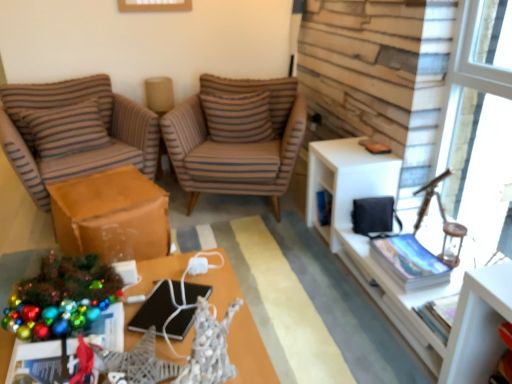
Describe the element at coordinates (154, 309) in the screenshot. I see `black matte laptop at center` at that location.

You are a GUI agent. You are given a task and a screenshot of the screen. Output one action in this format:
    pyautogui.click(x=<x>, y=<y>)
    Task: Click on the brown paper bag at lower left
    
    Given the screenshot: What is the action you would take?
    pyautogui.click(x=111, y=216)

The image size is (512, 384). What do you see at coordinates (111, 216) in the screenshot? I see `brown paper bag at lower left` at bounding box center [111, 216].

At what (x,y) coordinates should I click in order to perform the action: click on striped fabric pillow at left, which ranks as the first pillow in left-to-right order. Please return your answer as a coordinate pair (x, y). This screenshot has width=512, height=384. Looking at the image, I should click on (66, 128).

This screenshot has height=384, width=512. What do you see at coordinates (480, 124) in the screenshot?
I see `transparent glass window at upper right` at bounding box center [480, 124].

Measure the distance between point (372, 272) and camera.

Point (372, 272) is 6.40 feet from camera.

Locate an element on the screen. black matte laptop at center is located at coordinates (154, 309).

Based on their sizes in the image, would you say metallic silver desk at center is bigger or smaller than brown striped fabric chair at left, acting as the first chair starting from the left?

metallic silver desk at center is smaller than brown striped fabric chair at left, acting as the first chair starting from the left.

Can you confirm if metallic silver desk at center is thinner than brown striped fabric chair at left, acting as the first chair starting from the left?

Yes, metallic silver desk at center is thinner than brown striped fabric chair at left, acting as the first chair starting from the left.

Identify the location of chair that is the 1st object above the metallic silver desk at center (from a real-world perspective). (74, 132).

From the image's perspective, does metallic silver desk at center appear lower than brown striped fabric chair at left, positioned as the second chair in right-to-left order?

Yes.

Considering the relative sizes of transparent glass window at upper right and metallic silver desk at center in the image provided, is transparent glass window at upper right wider than metallic silver desk at center?

In fact, transparent glass window at upper right might be narrower than metallic silver desk at center.

Between transparent glass window at upper right and metallic silver desk at center, which one appears on the left side from the viewer's perspective?

metallic silver desk at center.

I want to click on window that is above the metallic silver desk at center (from the image's perspective), so click(x=480, y=124).

From a real-world perspective, is transparent glass window at upper right above or below metallic silver desk at center?

In terms of real-world spatial position, transparent glass window at upper right is above metallic silver desk at center.

Choose the correct answer: Is brown striped pillow at center, the first pillow in the right-to-left sequence, inside black matte laptop at center or outside it?

brown striped pillow at center, the first pillow in the right-to-left sequence, is not inside black matte laptop at center, it's outside.

Is brown striped pillow at center, which is the second pillow in left-to-right order, bigger than black matte laptop at center?

Correct, brown striped pillow at center, which is the second pillow in left-to-right order, is larger in size than black matte laptop at center.

Looking at this image, considering the sizes of brown striped pillow at center, the first pillow in the right-to-left sequence, and black matte laptop at center in the image, is brown striped pillow at center, the first pillow in the right-to-left sequence, wider or thinner than black matte laptop at center?

Clearly, brown striped pillow at center, the first pillow in the right-to-left sequence, has more width compared to black matte laptop at center.

Identify the location of laptop that is below the brown striped pillow at center, which is the second pillow in left-to-right order (from the image's perspective). (154, 309).

Which object is further away from the camera taking this photo, brown paper bag at lower left or transparent glass window at upper right?

Positioned behind is brown paper bag at lower left.

Which object is positioned more to the right, brown paper bag at lower left or transparent glass window at upper right?

transparent glass window at upper right is more to the right.

From the image's perspective, is brown paper bag at lower left located above or below transparent glass window at upper right?

Based on their image positions, brown paper bag at lower left is located beneath transparent glass window at upper right.

Can you tell me how much brown paper bag at lower left and transparent glass window at upper right differ in facing direction?

The angle between the facing direction of brown paper bag at lower left and the facing direction of transparent glass window at upper right is 112 degrees.

Is brown striped fabric chair at left, acting as the first chair starting from the left, beside striped fabric pillow at left, which ranks as the first pillow in left-to-right order?

Yes, the surface of brown striped fabric chair at left, acting as the first chair starting from the left, is in contact with striped fabric pillow at left, which ranks as the first pillow in left-to-right order.

Between brown striped fabric chair at left, acting as the first chair starting from the left, and striped fabric pillow at left, which ranks as the first pillow in left-to-right order, which one appears on the left side from the viewer's perspective?

striped fabric pillow at left, which ranks as the first pillow in left-to-right order.

Is brown striped fabric chair at left, positioned as the second chair in right-to-left order, taller or shorter than striped fabric pillow at left, which ranks as the first pillow in left-to-right order?

In the image, brown striped fabric chair at left, positioned as the second chair in right-to-left order, appears to be taller than striped fabric pillow at left, which ranks as the first pillow in left-to-right order.

Between black matte laptop at center and metallic silver desk at center, which one appears on the left side from the viewer's perspective?

Positioned to the left is metallic silver desk at center.

In the scene shown: Would you say metallic silver desk at center is part of black matte laptop at center's contents?

Actually, metallic silver desk at center is outside black matte laptop at center.

Considering the sizes of objects black matte laptop at center and metallic silver desk at center in the image provided, who is wider, black matte laptop at center or metallic silver desk at center?

With larger width is metallic silver desk at center.

Which is nearer, (140,316) or (259,373)?

Point (140,316) is positioned farther from the camera compared to point (259,373).

Is white matte cabinet at right to the left of black matte laptop at center from the viewer's perspective?

No.

Which object is closer to the camera taking this photo, white matte cabinet at right or black matte laptop at center?

Positioned in front is white matte cabinet at right.

Is there a large distance between white matte cabinet at right and black matte laptop at center?

white matte cabinet at right is actually quite close to black matte laptop at center.

Who is taller, white matte cabinet at right or black matte laptop at center?

With more height is white matte cabinet at right.

Locate an element on the screen. This screenshot has width=512, height=384. desk below the brown striped fabric chair at left, acting as the first chair starting from the left (from a real-world perspective) is located at coordinates (249, 351).

Where is `desk below the transparent glass window at upper right (from the image's perspective)`? This screenshot has width=512, height=384. desk below the transparent glass window at upper right (from the image's perspective) is located at coordinates (249, 351).

From the picture: From the image, which object appears to be farther from white matte cabinet at right, brown striped pillow at center, the first pillow in the right-to-left sequence, or black matte laptop at center?

The object further to white matte cabinet at right is brown striped pillow at center, the first pillow in the right-to-left sequence.

From the image, which object appears to be farther from black matte laptop at center, brown paper bag at lower left or striped fabric pillow at left, the second pillow when ordered from right to left?

striped fabric pillow at left, the second pillow when ordered from right to left, lies further to black matte laptop at center than the other object.

When comparing their distances from brown striped pillow at center, the first pillow in the right-to-left sequence, does brown paper bag at lower left or brown striped fabric chair at left, acting as the first chair starting from the left, seem further?

The object further to brown striped pillow at center, the first pillow in the right-to-left sequence, is brown paper bag at lower left.

Looking at the image, which one is located closer to brown striped fabric chair at left, acting as the first chair starting from the left, striped fabric pillow at left, which ranks as the first pillow in left-to-right order, or brown striped fabric chair at center, arranged as the first chair when viewed from the right?

striped fabric pillow at left, which ranks as the first pillow in left-to-right order.

When comparing their distances from brown paper bag at lower left, does transparent glass window at upper right or black matte laptop at center seem closer?

black matte laptop at center.

Which object lies further to the anchor point transparent glass window at upper right, striped fabric pillow at left, the second pillow when ordered from right to left, or brown striped fabric chair at left, acting as the first chair starting from the left?

striped fabric pillow at left, the second pillow when ordered from right to left, is positioned further to the anchor transparent glass window at upper right.

Which object lies nearer to the anchor point brown striped fabric chair at center, arranged as the first chair when viewed from the right, transparent glass window at upper right or brown striped fabric chair at left, positioned as the second chair in right-to-left order?

brown striped fabric chair at left, positioned as the second chair in right-to-left order.

Looking at the image, which one is located closer to black matte laptop at center, transparent glass window at upper right or metallic silver desk at center?

metallic silver desk at center is closer to black matte laptop at center.

Where is `cabinetry positioned between metallic silver desk at center and brown striped pillow at center, the first pillow in the right-to-left sequence, from near to far`? This screenshot has height=384, width=512. cabinetry positioned between metallic silver desk at center and brown striped pillow at center, the first pillow in the right-to-left sequence, from near to far is located at coordinates (383, 270).

The height and width of the screenshot is (384, 512). Identify the location of desk situated between striped fabric pillow at left, which ranks as the first pillow in left-to-right order, and white matte cabinet at right from left to right. (249, 351).

Locate an element on the screen. Image resolution: width=512 pixels, height=384 pixels. table positioned between metallic silver desk at center and striped fabric pillow at left, the second pillow when ordered from right to left, from near to far is located at coordinates (111, 216).

Locate an element on the screen. This screenshot has width=512, height=384. pillow between metallic silver desk at center and brown striped pillow at center, which is the second pillow in left-to-right order, along the z-axis is located at coordinates 66,128.